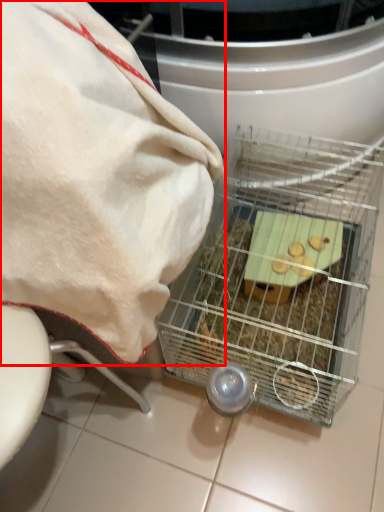
Question: Where is towel (annotated by the red box) located in relation to appliance in the image?

Choices:
 (A) left
 (B) right

Answer: (A)